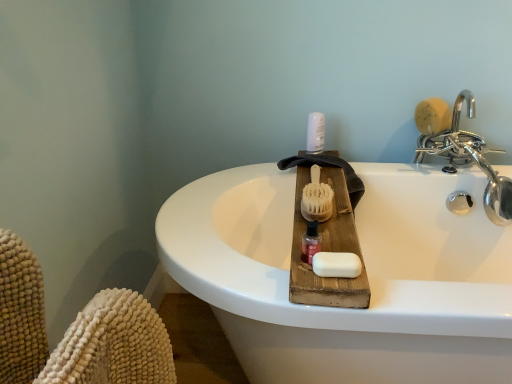
Question: Is white plastic bottle at upper center not near pink glossy bottle at center?

Choices:
 (A) yes
 (B) no

Answer: (B)

Question: Considering the relative sizes of white plastic bottle at upper center and pink glossy bottle at center in the image provided, is white plastic bottle at upper center thinner than pink glossy bottle at center?

Choices:
 (A) no
 (B) yes

Answer: (A)

Question: From a real-world perspective, is white plastic bottle at upper center below pink glossy bottle at center?

Choices:
 (A) yes
 (B) no

Answer: (B)

Question: Does white plastic bottle at upper center have a greater width compared to pink glossy bottle at center?

Choices:
 (A) no
 (B) yes

Answer: (B)

Question: Is white plastic bottle at upper center to the left of pink glossy bottle at center from the viewer's perspective?

Choices:
 (A) no
 (B) yes

Answer: (A)

Question: Can you confirm if white plastic bottle at upper center is positioned to the right of pink glossy bottle at center?

Choices:
 (A) no
 (B) yes

Answer: (B)

Question: Is pink glossy bottle at center in front of chrome metallic faucet at upper right?

Choices:
 (A) no
 (B) yes

Answer: (B)

Question: Would you say pink glossy bottle at center contains chrome metallic faucet at upper right?

Choices:
 (A) no
 (B) yes

Answer: (A)

Question: From the image's perspective, is pink glossy bottle at center on chrome metallic faucet at upper right?

Choices:
 (A) yes
 (B) no

Answer: (B)

Question: Is pink glossy bottle at center smaller than chrome metallic faucet at upper right?

Choices:
 (A) no
 (B) yes

Answer: (B)

Question: Is pink glossy bottle at center turned away from chrome metallic faucet at upper right?

Choices:
 (A) yes
 (B) no

Answer: (B)

Question: Is pink glossy bottle at center aimed at chrome metallic faucet at upper right?

Choices:
 (A) yes
 (B) no

Answer: (B)

Question: Is wooden bristle brush at center, marked as the first brush in a bottom-to-top arrangement, at the back of white plastic bottle at upper center?

Choices:
 (A) no
 (B) yes

Answer: (A)